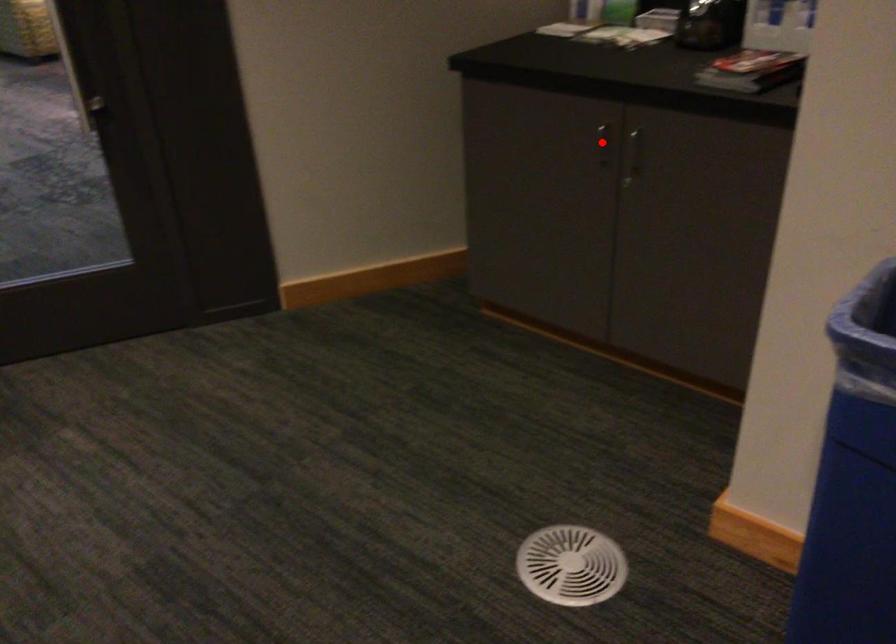
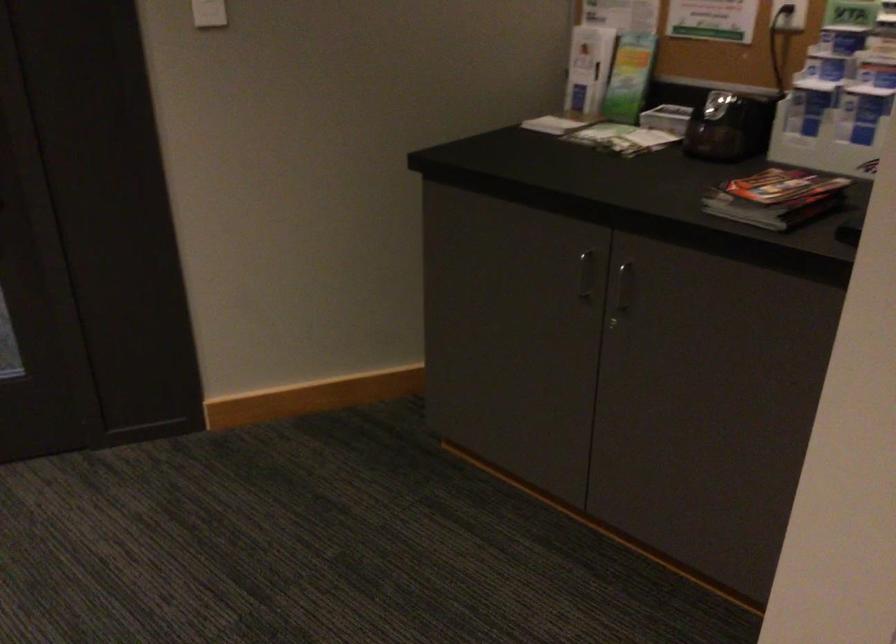
Locate, in the second image, the point that corresponds to the highlighted location in the first image.

(584, 275)